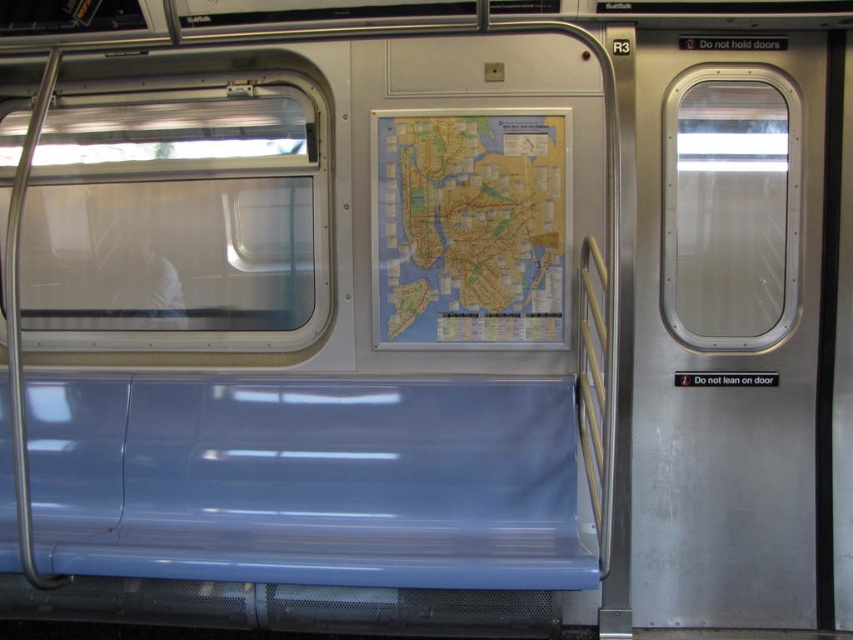
You are a passenger standing inside the subway car and want to exit through the stainless steel door at right. Is the map at center between you and the door?

The stainless steel door at right is closer to the viewer than the map at center, so the map at center is not between you and the door.